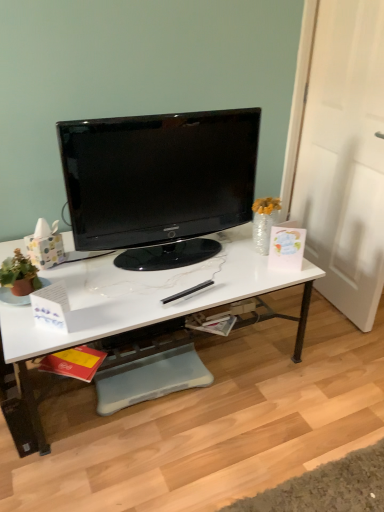
This screenshot has width=384, height=512. What are the coordinates of `free space underneath black glossy television at center (from a real-world perspective)` in the screenshot? It's located at (161, 258).